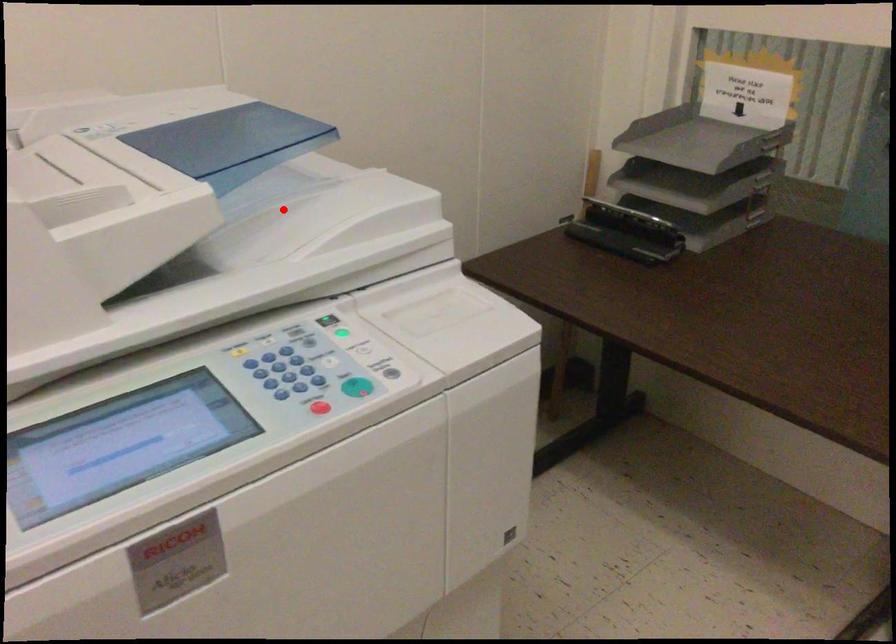
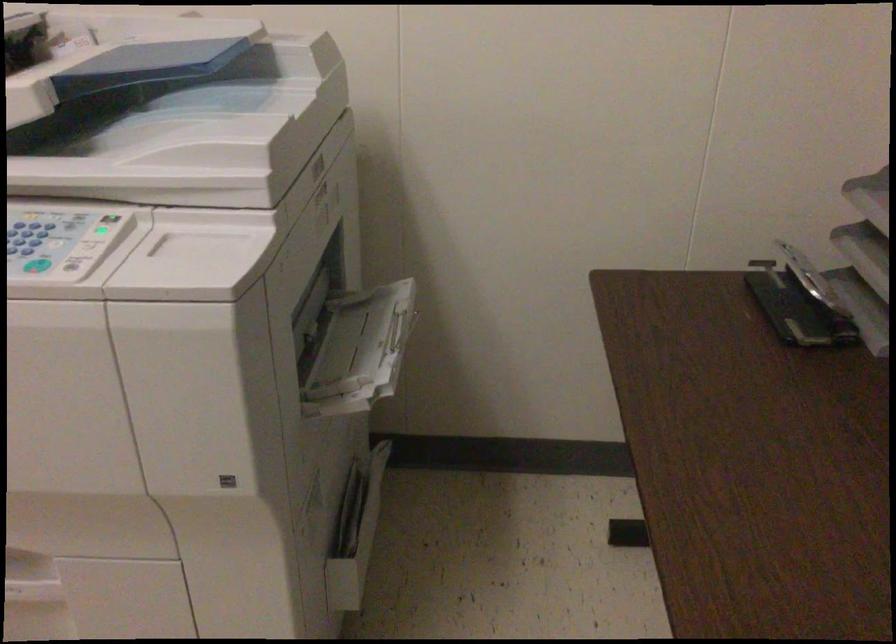
In the second image, find the point that corresponds to the highlighted location in the first image.

(173, 126)